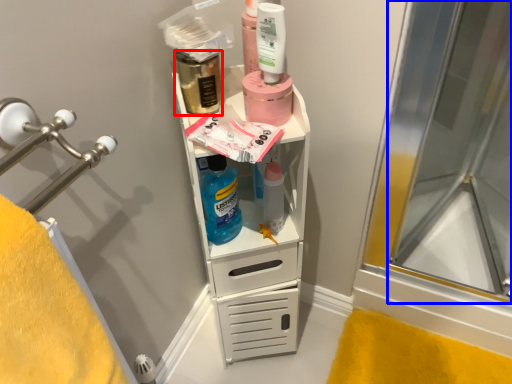
Question: Which of the following is the closest to the observer, mouthwash (highlighted by a red box) or screen door (highlighted by a blue box)?

Choices:
 (A) mouthwash
 (B) screen door

Answer: (B)